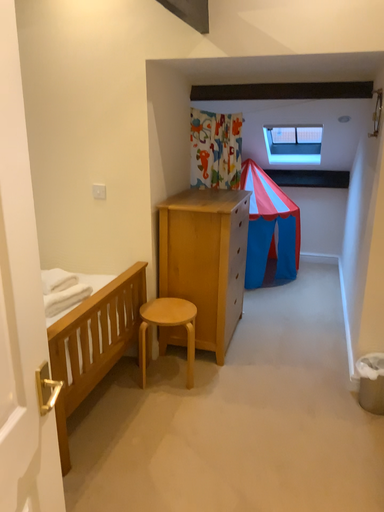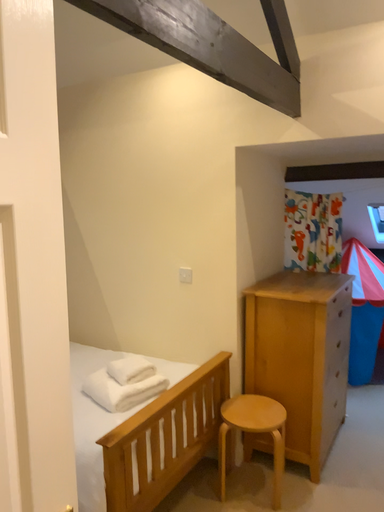
Question: How did the camera likely rotate when shooting the video?

Choices:
 (A) rotated upward
 (B) rotated downward

Answer: (A)